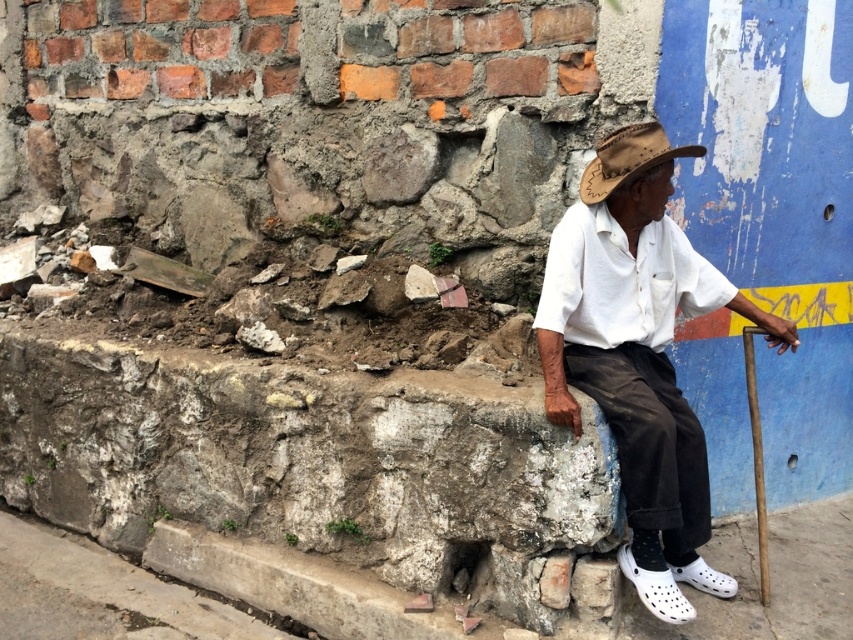
Question: Which of the following is the farthest from the observer?

Choices:
 (A) (733, 589)
 (B) (660, 602)

Answer: (A)

Question: Is white cotton shirt at center behind brown leather cowboy hat at center?

Choices:
 (A) yes
 (B) no

Answer: (B)

Question: Which object is closer to the camera taking this photo?

Choices:
 (A) white croc at lower right
 (B) white cotton shirt at center
 (C) white croc shoes at lower center

Answer: (B)

Question: Does white cotton shirt at center have a smaller size compared to white croc at lower right?

Choices:
 (A) yes
 (B) no

Answer: (B)

Question: Which point is farther from the camera taking this photo?

Choices:
 (A) (611, 138)
 (B) (718, 573)
 (C) (653, 326)
 (D) (664, 576)

Answer: (B)

Question: Is white cotton shirt at center positioned before white croc shoes at lower center?

Choices:
 (A) no
 (B) yes

Answer: (B)